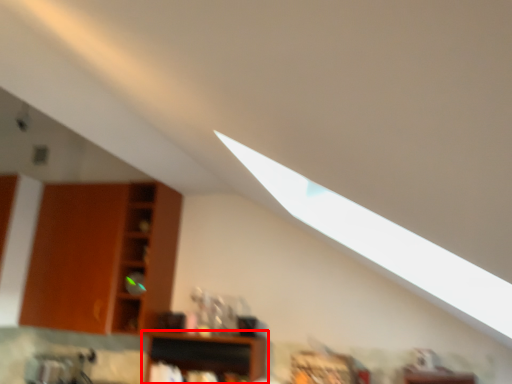
Question: From the image's perspective, considering the relative positions of shelf (annotated by the red box) and shelf in the image provided, where is shelf (annotated by the red box) located with respect to the staircase?

Choices:
 (A) below
 (B) above

Answer: (A)